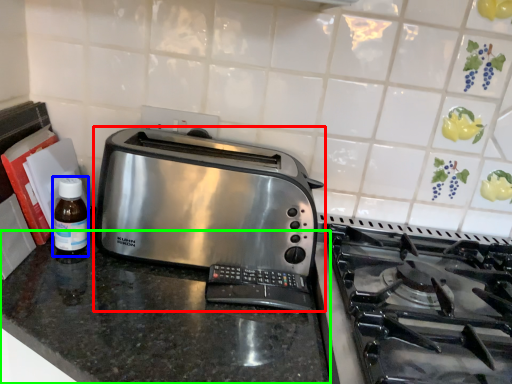
Question: Which is nearer to the toaster (highlighted by a red box)? bottle (highlighted by a blue box) or counter (highlighted by a green box).

Choices:
 (A) bottle
 (B) counter

Answer: (B)